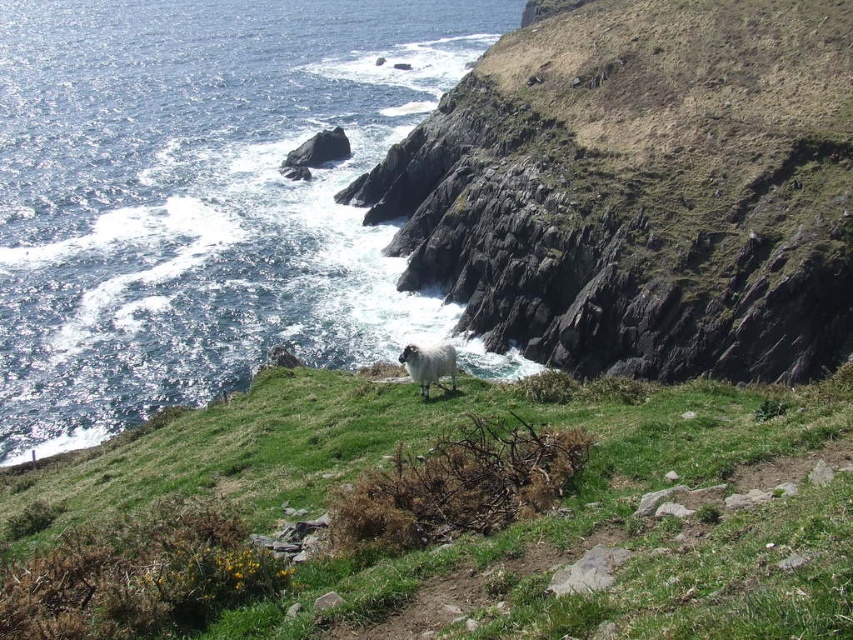
You are a hiker standing at the base of the cliff and want to reach the point marked as point (457,513). Based on the scene description, which direction should you head towards?

The point (457,513) is located on the green grassy area at upper center. Since you are at the base of the cliff, you should head upwards towards the upper center direction to reach the point.

You are a hiker who wants to reach the white woolly sheep at center from the grassy hillside at upper right. Which direction should you move relative to your current position?

The grassy hillside at upper right is located above the white woolly sheep at center, so you should move downward to reach the sheep.